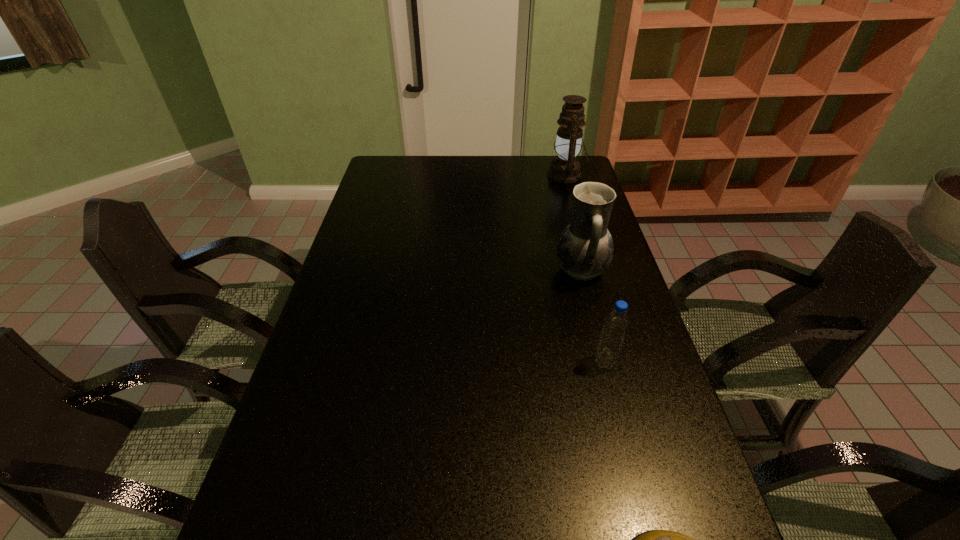
This screenshot has height=540, width=960. I want to click on the farthest object, so 564,169.

Find the location of a particular element. Image resolution: width=960 pixels, height=540 pixels. the third nearest object is located at coordinates (585, 248).

Identify the location of the third shortest object. (585, 248).

The width and height of the screenshot is (960, 540). I want to click on the third tallest object, so click(615, 326).

Image resolution: width=960 pixels, height=540 pixels. What are the coordinates of `the second nearest object` in the screenshot? It's located at (615, 326).

Locate an element on the screen. Image resolution: width=960 pixels, height=540 pixels. vacant space located 0.320m on the left of the farthest object is located at coordinates (470, 175).

Where is `vacant area situated on the front-facing side of the pitcher`? vacant area situated on the front-facing side of the pitcher is located at coordinates (510, 270).

At what (x,y) coordinates should I click in order to perform the action: click on vacant space located 0.380m on the front-facing side of the pitcher. Please return your answer as a coordinate pair (x, y). This screenshot has height=540, width=960. Looking at the image, I should click on (434, 270).

Locate an element on the screen. vacant area situated on the front-facing side of the pitcher is located at coordinates (427, 270).

Locate an element on the screen. Image resolution: width=960 pixels, height=540 pixels. vacant space situated on the left of the third farthest object is located at coordinates (504, 362).